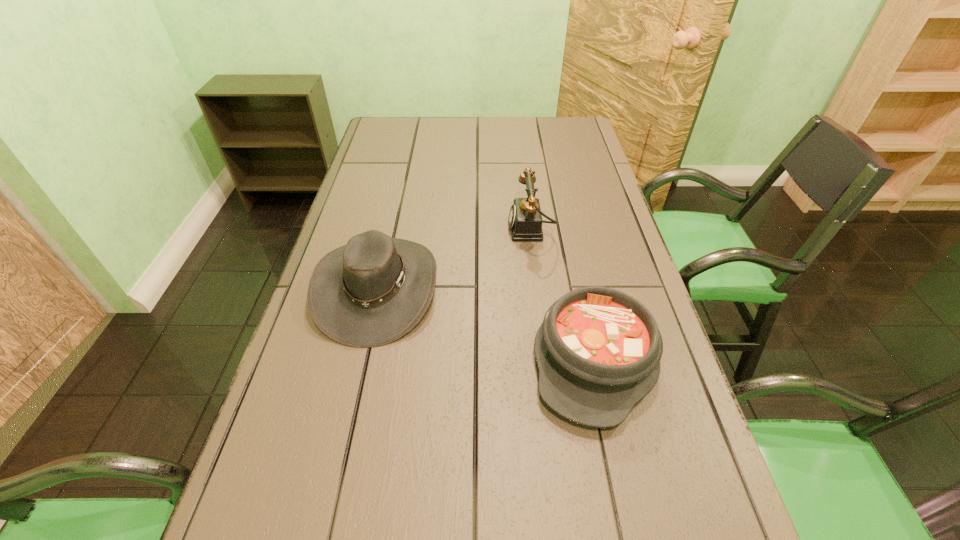
Find the location of `free space that satisfies the following two spatial constraints: 1. on the front side of the second nearest white detergent; 2. on the left side of the farthest white detergent`. free space that satisfies the following two spatial constraints: 1. on the front side of the second nearest white detergent; 2. on the left side of the farthest white detergent is located at coordinates (525, 331).